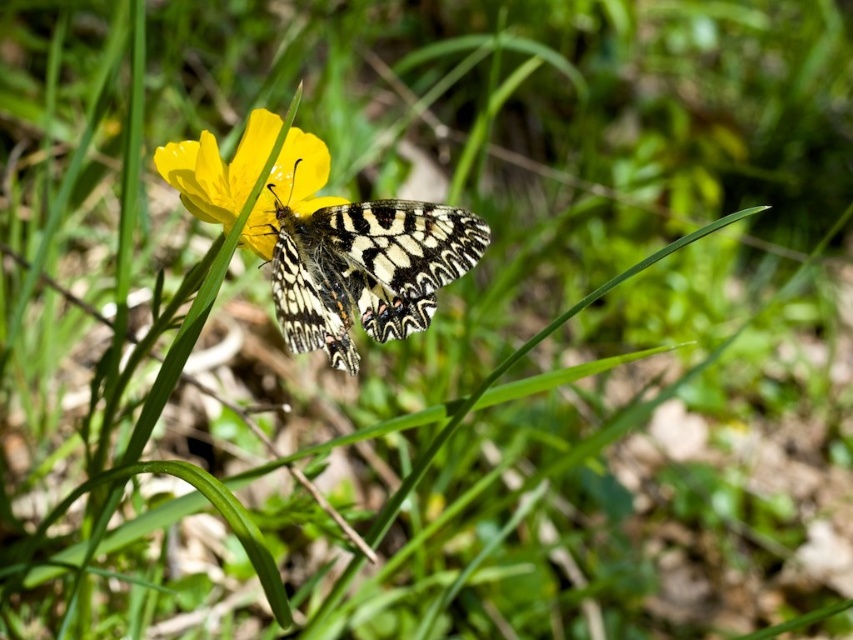
Question: Which of the following is the farthest from the observer?

Choices:
 (A) yellow matte flower at center
 (B) patterned wings butterfly at center

Answer: (B)

Question: Does patterned wings butterfly at center appear on the right side of yellow matte flower at center?

Choices:
 (A) yes
 (B) no

Answer: (A)

Question: Which of the following is the farthest from the observer?

Choices:
 (A) patterned wings butterfly at center
 (B) yellow matte flower at center

Answer: (A)

Question: Can you confirm if patterned wings butterfly at center is thinner than yellow matte flower at center?

Choices:
 (A) no
 (B) yes

Answer: (A)

Question: Which of the following is the closest to the observer?

Choices:
 (A) (366, 262)
 (B) (154, 161)

Answer: (B)

Question: Can you confirm if patterned wings butterfly at center is positioned above yellow matte flower at center?

Choices:
 (A) yes
 (B) no

Answer: (B)